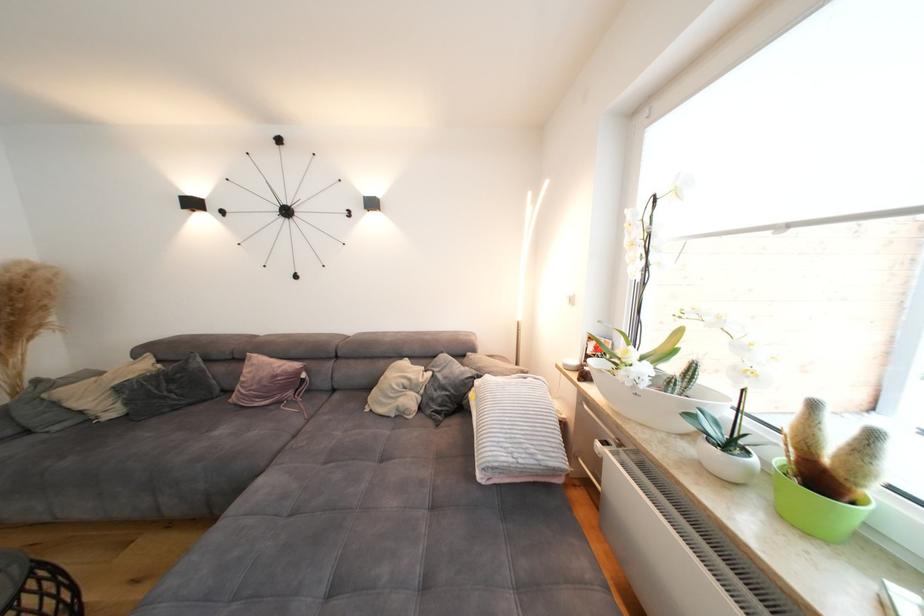
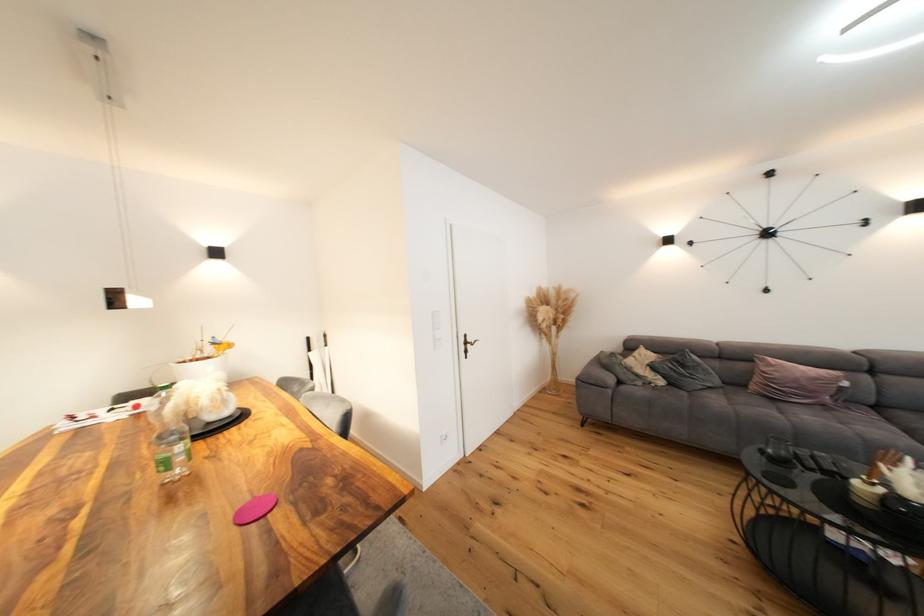
Locate, in the second image, the point that corresponds to point (62, 407) in the first image.

(637, 371)